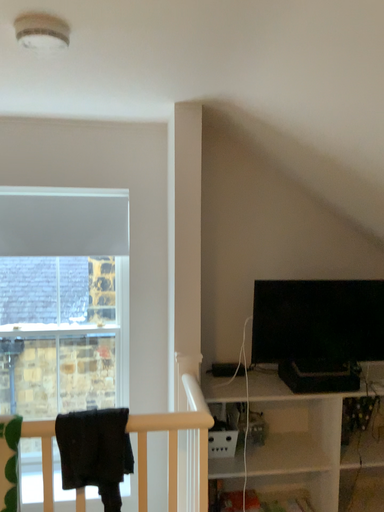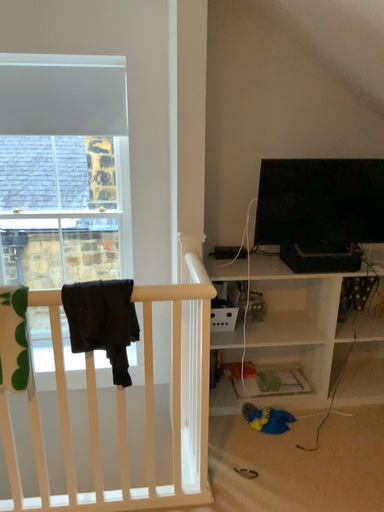
Question: Which way did the camera rotate in the video?

Choices:
 (A) rotated downward
 (B) rotated upward

Answer: (A)